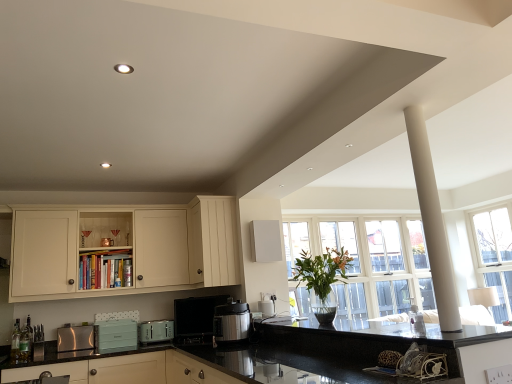
Question: Does metallic silver can at upper left, which appears as the first bottle when viewed from the back, have a smaller size compared to green glass bottle at lower left, positioned as the second bottle in left-to-right order?

Choices:
 (A) no
 (B) yes

Answer: (B)

Question: From a real-world perspective, is metallic silver can at upper left, which is counted as the third bottle, starting from the front, located higher than green glass bottle at lower left, positioned as the second bottle in left-to-right order?

Choices:
 (A) yes
 (B) no

Answer: (A)

Question: Is metallic silver can at upper left, which is counted as the 3th bottle, starting from the bottom, located outside green glass bottle at lower left, which is counted as the second bottle, starting from the back?

Choices:
 (A) yes
 (B) no

Answer: (A)

Question: From the image's perspective, is metallic silver can at upper left, which is counted as the 3th bottle, starting from the bottom, below green glass bottle at lower left, positioned as the second bottle in left-to-right order?

Choices:
 (A) no
 (B) yes

Answer: (A)

Question: Is metallic silver can at upper left, the first bottle positioned from the top, closer to camera compared to green glass bottle at lower left, which is the first bottle from bottom to top?

Choices:
 (A) yes
 (B) no

Answer: (B)

Question: Does metallic silver can at upper left, which appears as the first bottle when viewed from the back, turn towards green glass bottle at lower left, which is the first bottle from bottom to top?

Choices:
 (A) no
 (B) yes

Answer: (A)

Question: From the image's perspective, would you say white smooth column at upper right is shown under green glass bottle at lower left, the second bottle viewed from the front?

Choices:
 (A) yes
 (B) no

Answer: (B)

Question: Considering the relative positions of white smooth column at upper right and green glass bottle at lower left, positioned as the second bottle in left-to-right order, in the image provided, is white smooth column at upper right to the left of green glass bottle at lower left, positioned as the second bottle in left-to-right order, from the viewer's perspective?

Choices:
 (A) yes
 (B) no

Answer: (B)

Question: Is white smooth column at upper right far away from green glass bottle at lower left, the second bottle positioned from the right?

Choices:
 (A) no
 (B) yes

Answer: (B)

Question: Is green glass bottle at lower left, positioned as the second bottle in left-to-right order, at the back of white smooth column at upper right?

Choices:
 (A) no
 (B) yes

Answer: (A)

Question: Does white smooth column at upper right have a lesser height compared to green glass bottle at lower left, which ranks as the third bottle in top-to-bottom order?

Choices:
 (A) yes
 (B) no

Answer: (B)

Question: Does white smooth column at upper right have a greater width compared to green glass bottle at lower left, which ranks as the third bottle in top-to-bottom order?

Choices:
 (A) yes
 (B) no

Answer: (A)

Question: Can you confirm if black granite countertop at center, the 1th countertop when ordered from left to right, is wider than white smooth column at upper right?

Choices:
 (A) yes
 (B) no

Answer: (A)